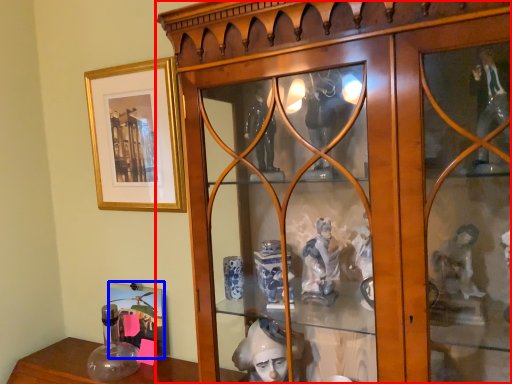
Question: Which point is further to the camera, furniture (highlighted by a red box) or picture frame (highlighted by a blue box)?

Choices:
 (A) furniture
 (B) picture frame

Answer: (B)